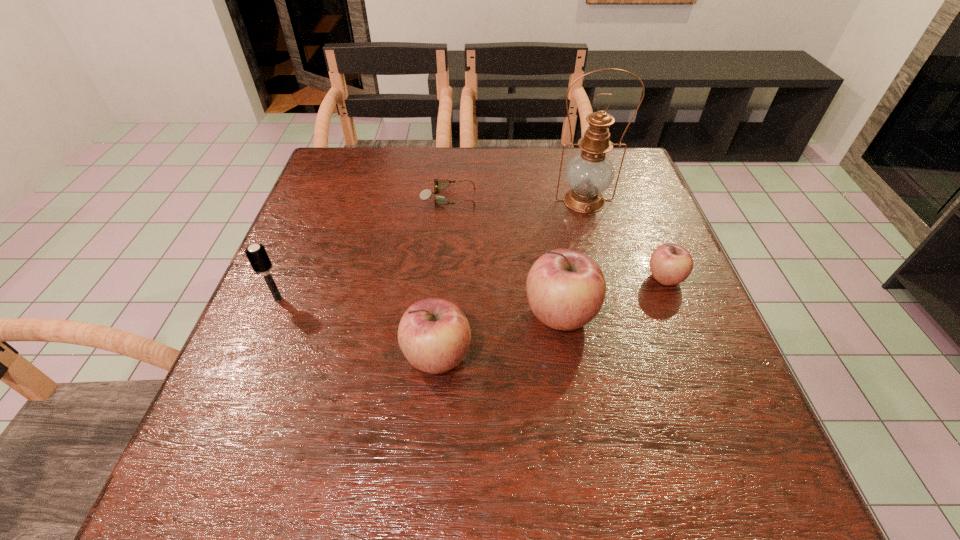
This screenshot has height=540, width=960. In order to click on the leftmost apple in this screenshot , I will do `click(434, 334)`.

I want to click on the second apple from left to right, so click(x=566, y=289).

Locate an element on the screen. The height and width of the screenshot is (540, 960). the rightmost object is located at coordinates coord(670,264).

Identify the location of the shortest apple. (670, 264).

Find the location of a particular element. Image resolution: width=960 pixels, height=540 pixels. the shortest object is located at coordinates click(x=426, y=193).

The image size is (960, 540). In order to click on hairbrush in this screenshot , I will do `click(256, 254)`.

Where is `oil lamp`? This screenshot has height=540, width=960. oil lamp is located at coordinates 590,173.

The width and height of the screenshot is (960, 540). Find the location of `free space located 0.120m on the right of the second shortest apple`. free space located 0.120m on the right of the second shortest apple is located at coordinates (537, 357).

This screenshot has width=960, height=540. Identify the location of free region located 0.310m on the back of the second apple from left to right. (541, 200).

Find the location of a particular element. vacant area situated on the back of the shortest apple is located at coordinates (647, 235).